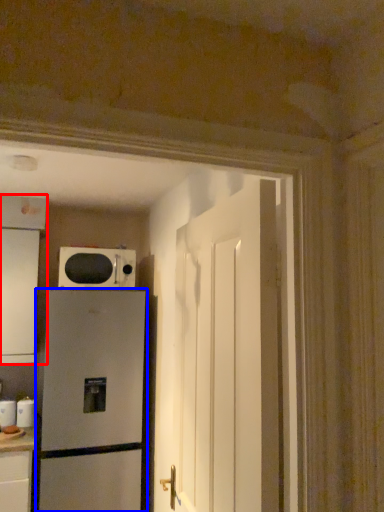
Question: Which point is further to the camera, cabinetry (highlighted by a red box) or refrigerator (highlighted by a blue box)?

Choices:
 (A) cabinetry
 (B) refrigerator

Answer: (A)